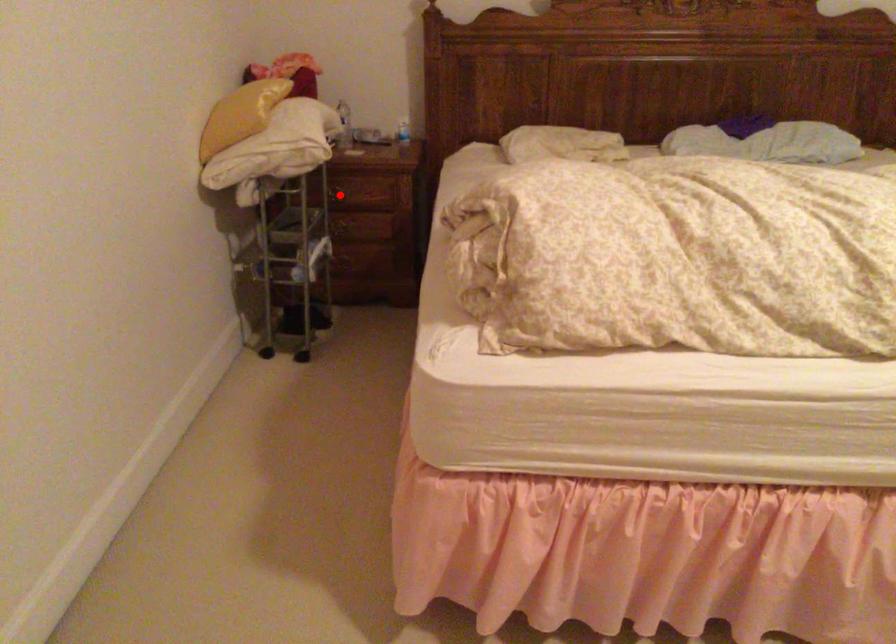
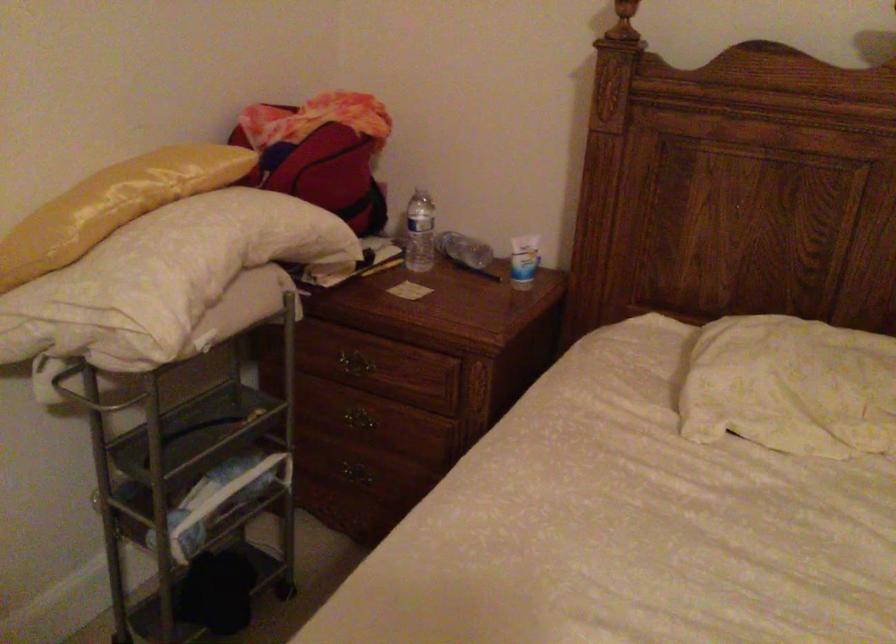
Question: A red point is marked in image1. In image2, is the corresponding 3D point closer to the camera or farther? Reply with the corresponding letter.

Choices:
 (A) The corresponding 3D point is closer.
 (B) The corresponding 3D point is farther.

Answer: (A)